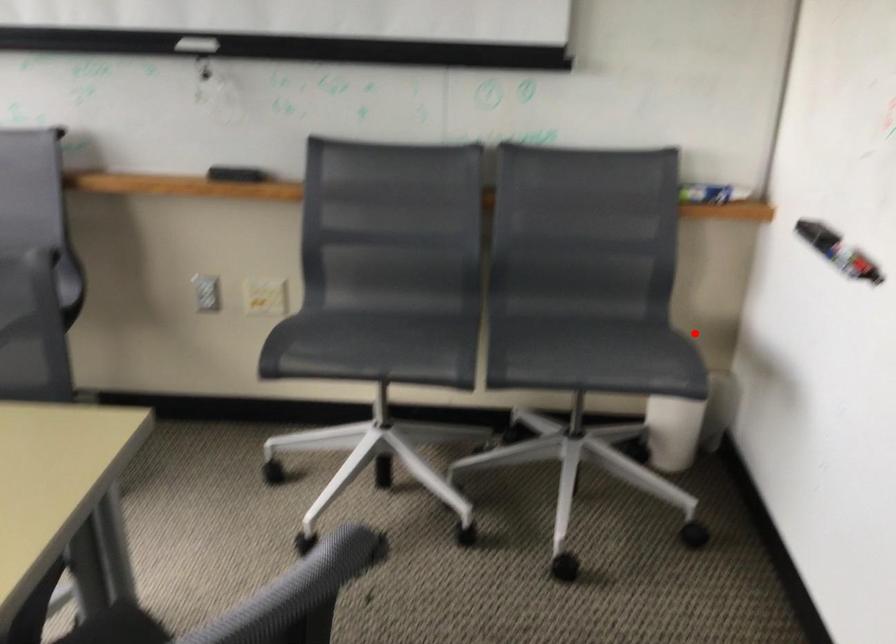
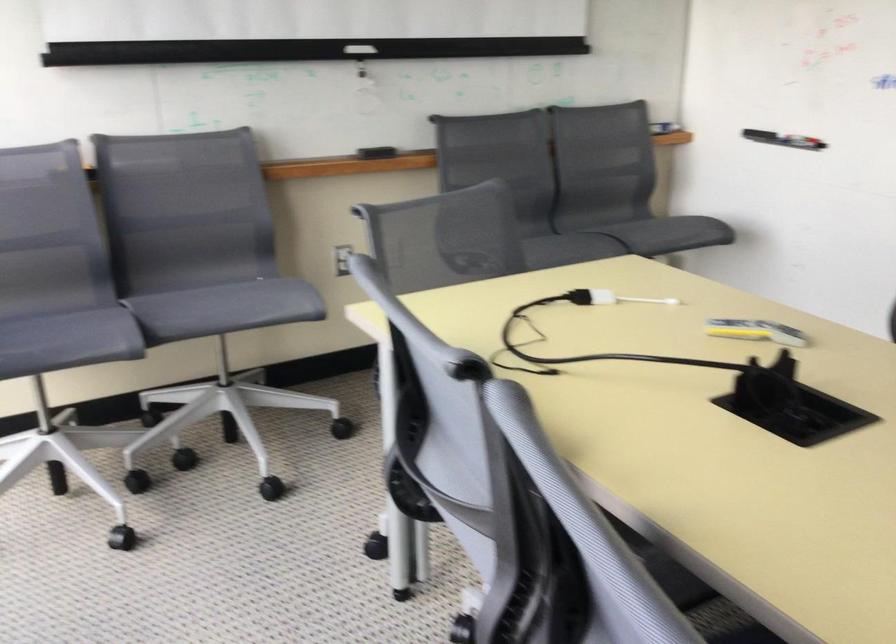
Question: I am providing you with two images of the same scene from different viewpoints. Given a red point in image1, look at the same physical point in image2. Is it:

Choices:
 (A) Closer to the viewpoint
 (B) Farther from the viewpoint

Answer: (B)